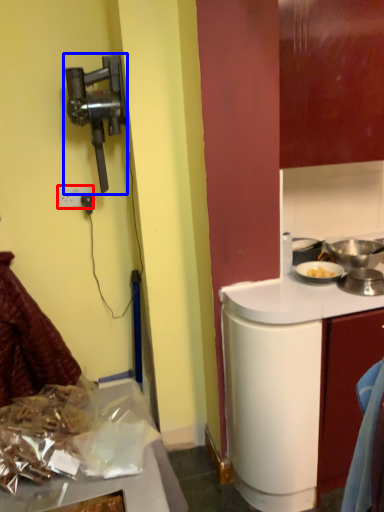
Question: Which point is closer to the camera, power outlet (highlighted by a red box) or home appliance (highlighted by a blue box)?

Choices:
 (A) power outlet
 (B) home appliance

Answer: (B)